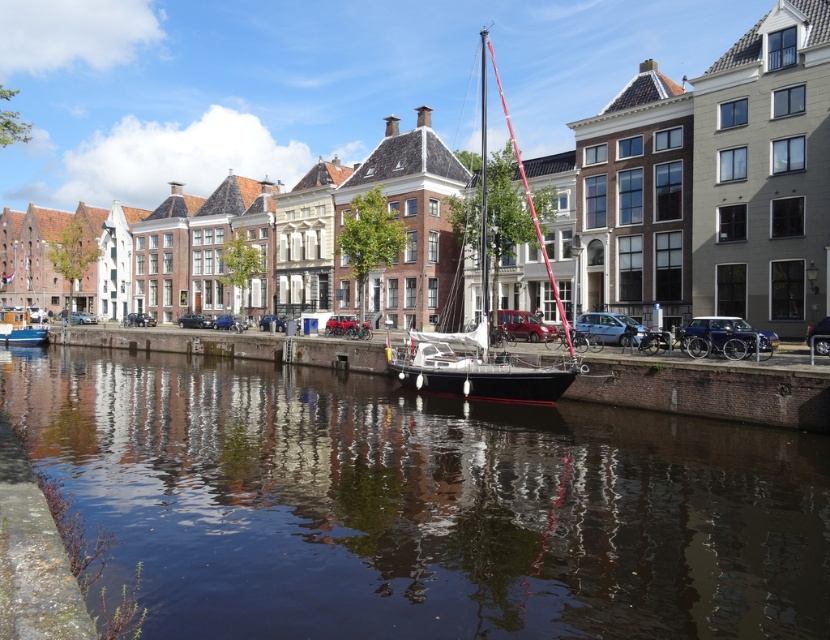
Question: Which object is positioned closest to the matte blue boat at lower left?

Choices:
 (A) smooth dark water at center
 (B) white sailboat at center

Answer: (A)

Question: Is white sailboat at center further to the viewer compared to matte blue boat at lower left?

Choices:
 (A) yes
 (B) no

Answer: (B)

Question: Does smooth dark water at center have a greater width compared to matte blue boat at lower left?

Choices:
 (A) no
 (B) yes

Answer: (B)

Question: Based on their relative distances, which object is farther from the smooth dark water at center?

Choices:
 (A) matte blue boat at lower left
 (B) white sailboat at center

Answer: (A)

Question: Is white sailboat at center positioned behind matte blue boat at lower left?

Choices:
 (A) no
 (B) yes

Answer: (A)

Question: Which point is closer to the camera taking this photo?

Choices:
 (A) tap(38, 337)
 (B) tap(486, 316)

Answer: (B)